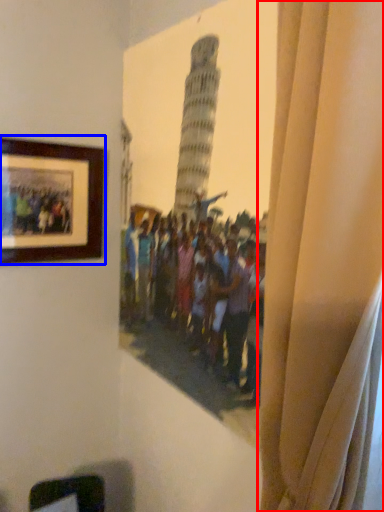
Question: Among these objects, which one is farthest to the camera, curtain (highlighted by a red box) or picture frame (highlighted by a blue box)?

Choices:
 (A) curtain
 (B) picture frame

Answer: (B)